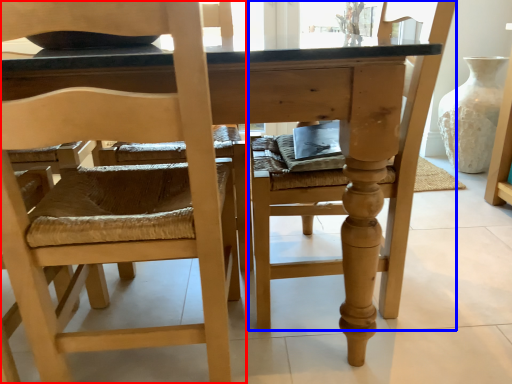
Question: Which object appears closest to the camera in this image, chair (highlighted by a red box) or chair (highlighted by a blue box)?

Choices:
 (A) chair
 (B) chair

Answer: (A)